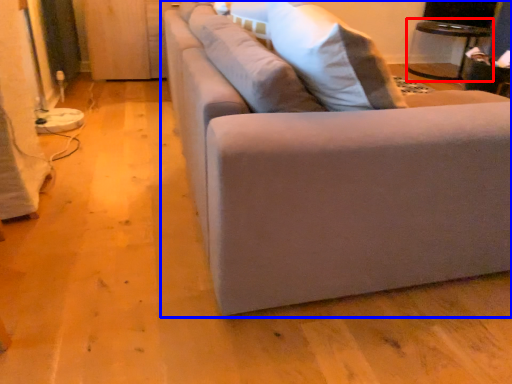
Question: Which point is further to the camera, table (highlighted by a red box) or studio couch (highlighted by a blue box)?

Choices:
 (A) table
 (B) studio couch

Answer: (A)